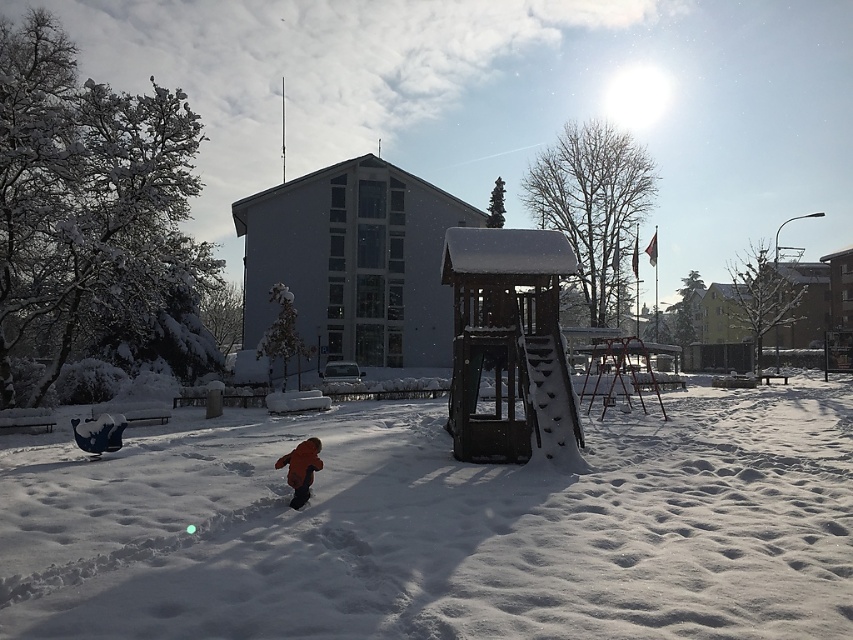
You are a photographer trying to capture the orange fuzzy coat at center and the white fluffy snow at center in the same frame. Based on their positions, which object should you adjust your camera to focus on first to include both in the shot?

The white fluffy snow at center is to the right of orange fuzzy coat at center, so you should focus on the orange fuzzy coat at center first to ensure both objects are within the frame.

You are standing at the point with coordinates point (291, 458) and want to walk towards the play structure. There is an obstacle at point (544, 552). Will you encounter the obstacle before reaching the play structure?

Point (544, 552) is in front of point (291, 458), so yes, you will encounter the obstacle at point (544, 552) before reaching the play structure.

From the picture: You are standing at the center of the park and want to place a small snowman using the white fluffy snow at center. Where exactly should you go to gather the snow?

The white fluffy snow at center is located at point [444,531], so you should go to that coordinate to gather the snow.